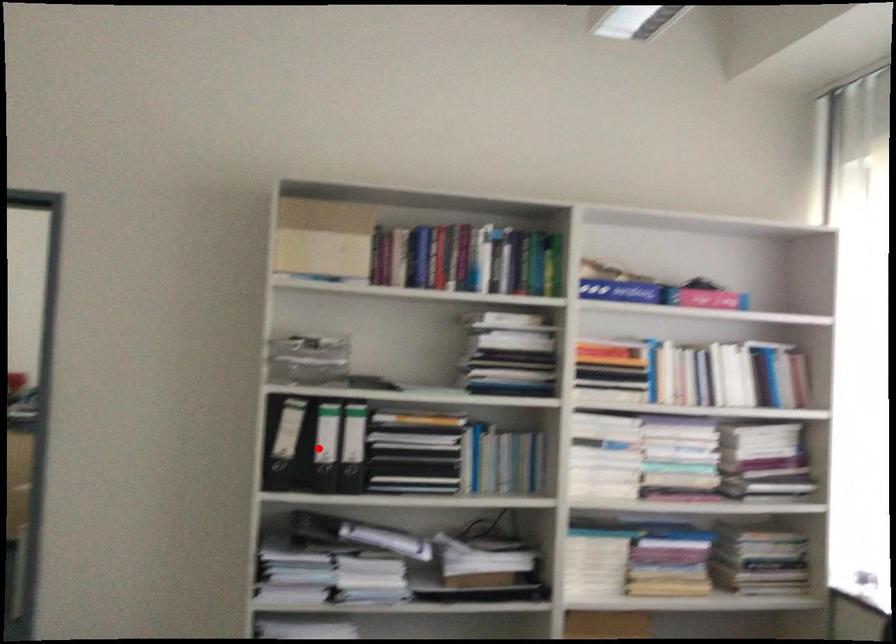
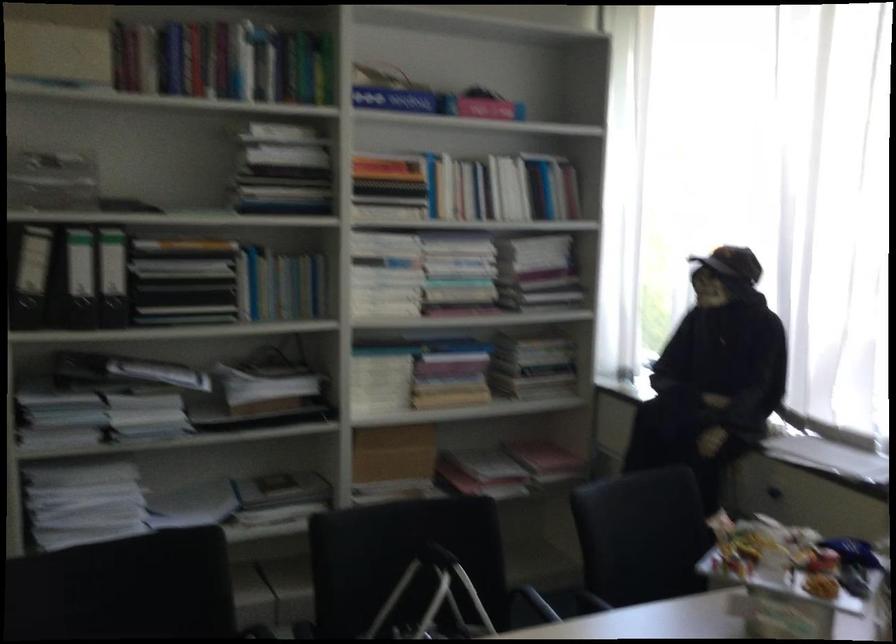
Find the pixel in the second image that matches the highlighted location in the first image.

(81, 279)